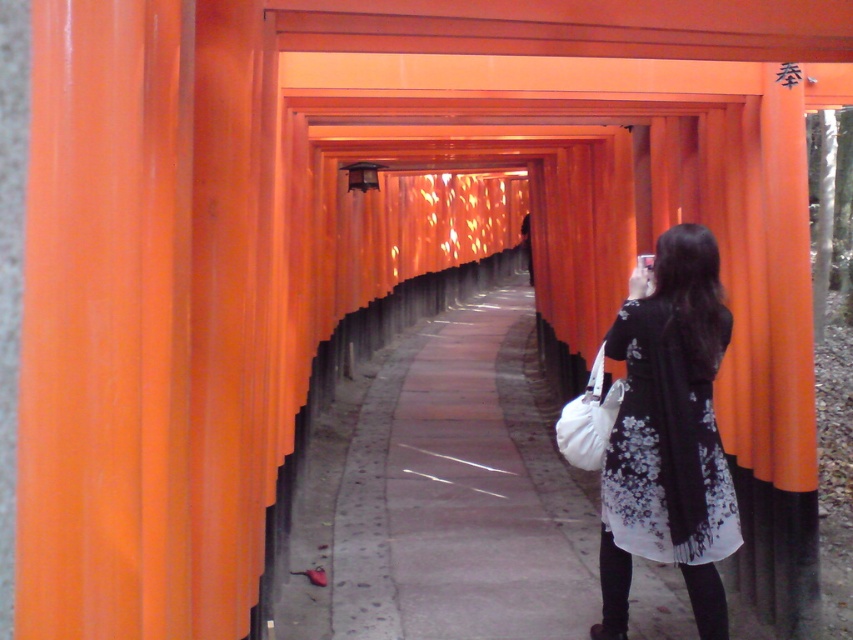
Question: Which of the following is the farthest from the observer?

Choices:
 (A) white fabric bag at center-right
 (B) black floral dress at center

Answer: (A)

Question: Can you confirm if black floral dress at center is smaller than white fabric bag at center-right?

Choices:
 (A) yes
 (B) no

Answer: (B)

Question: Is black floral dress at center to the left of white fabric bag at center-right from the viewer's perspective?

Choices:
 (A) yes
 (B) no

Answer: (B)

Question: Can you confirm if black floral dress at center is positioned to the left of white fabric bag at center-right?

Choices:
 (A) no
 (B) yes

Answer: (A)

Question: Among these points, which one is farthest from the camera?

Choices:
 (A) (697, 486)
 (B) (612, 384)

Answer: (B)